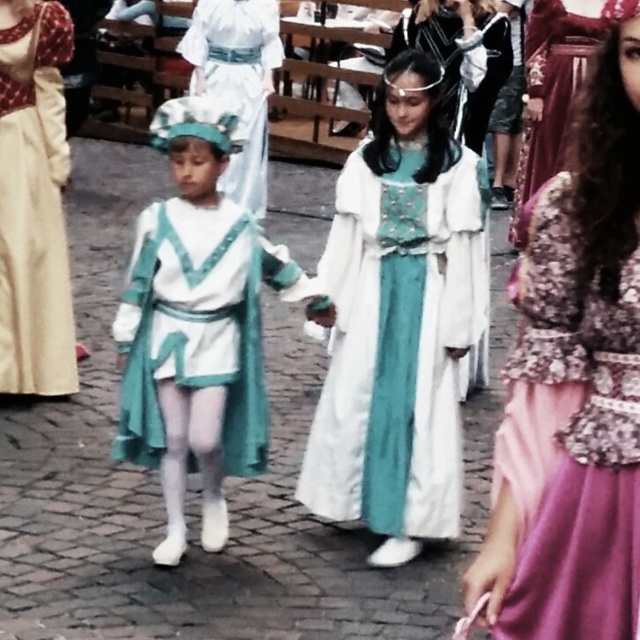
In order to click on pink satin dress at right in this screenshot , I will do `click(572, 438)`.

Between pink satin dress at right and matte white costume at center, which one appears on the left side from the viewer's perspective?

matte white costume at center

Between point (600, 396) and point (218, 541), which one is positioned behind?

Point (218, 541)

Locate an element on the screen. pink satin dress at right is located at coordinates (572, 438).

Can you confirm if white satin dress at center is positioned below teal satin dress at center?

Yes, white satin dress at center is below teal satin dress at center.

Is white satin dress at center to the right of teal satin dress at center from the viewer's perspective?

Yes, white satin dress at center is to the right of teal satin dress at center.

Where is `white satin dress at center`? This screenshot has width=640, height=640. white satin dress at center is located at coordinates (397, 344).

Is point (256, 307) in front of point (1, 202)?

Yes, point (256, 307) is closer to viewer.

What do you see at coordinates (196, 326) in the screenshot? The height and width of the screenshot is (640, 640). I see `matte white costume at center` at bounding box center [196, 326].

Does point (172, 209) come behind point (58, 317)?

No.

The width and height of the screenshot is (640, 640). In order to click on matte white costume at center in this screenshot , I will do `click(196, 326)`.